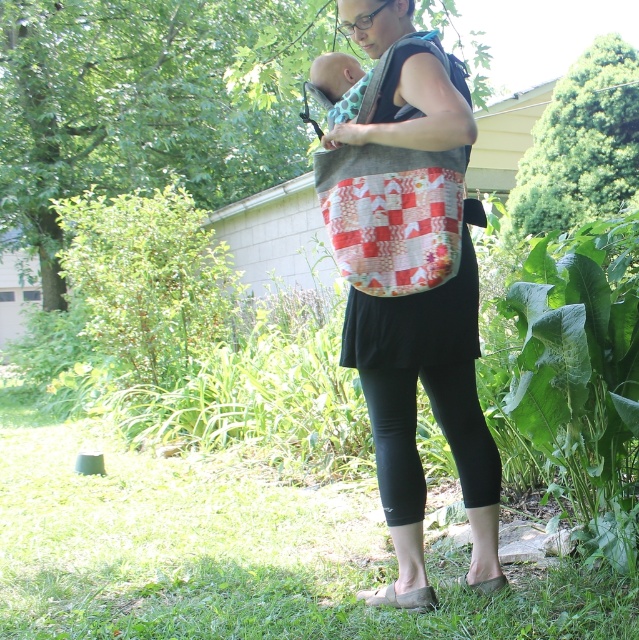
You are a photographer who needs to grab your camera quickly. You are currently holding the quilted fabric bag at center. Can you reach your camera without letting go of the bag?

The quilted fabric bag at center and camera are 2.54 meters apart from each other. Since the distance is over 2 meters, you cannot reach the camera while holding the bag.

You are a photographer trying to capture a closeup of the patchwork fabric bag at center and the black stretchy leggings at lower center in the image. Given that your camera can focus on objects within a 25 inch range, will you be able to capture both in focus without adjusting your camera settings?

The patchwork fabric bag at center and black stretchy leggings at lower center are 30.50 inches apart from each other. Since the distance between them exceeds the camera focus range of 25 inches, you will need to adjust your camera settings to ensure both are in focus.

You are a delivery person who needs to hand over a package to the person in the image. The package is too large to fit in your bag, so you need to place it somewhere near them. Where would you place the package so that it is closest to the person but not blocking their path? The available spots are marked as points on a grid from 0 to 1 in both x and y coordinates. The person is standing at point 0.5, 0.5. The possible spots are point A at [433,416] and point B at 0.3, 0.4. Use the information provided.

The quilted fabric bag at center is located at point A at [433,416]. Since the person is at 0.5, 0.5, point A is closer to them than point B at 0.3, 0.4. Therefore, placing the package at point A would be closer without blocking the path.